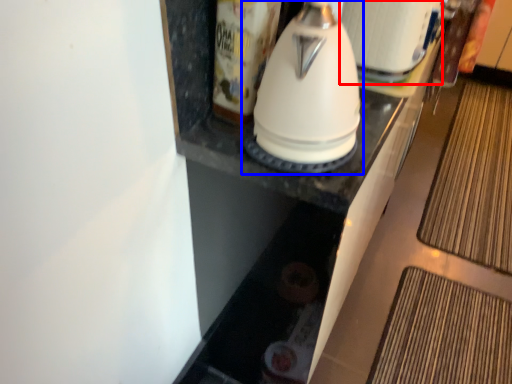
Question: Which of the following is the closest to the observer, appliance (highlighted by a red box) or kitchen appliance (highlighted by a blue box)?

Choices:
 (A) appliance
 (B) kitchen appliance

Answer: (B)